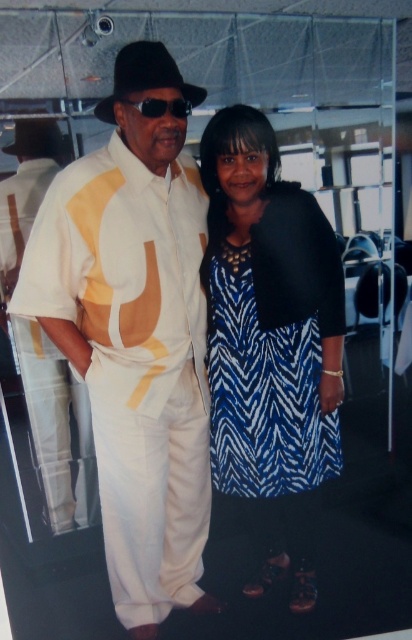
Question: Is blue zebra-patterned dress at center closer to camera compared to sunglasses at center?

Choices:
 (A) no
 (B) yes

Answer: (A)

Question: In this image, where is blue zebra-pattern dress at center located relative to sunglasses at center?

Choices:
 (A) right
 (B) left

Answer: (A)

Question: Which of the following is the farthest from the observer?

Choices:
 (A) blue zebra-pattern dress at center
 (B) white matte suit at left
 (C) sunglasses at center
 (D) blue zebra-patterned dress at center

Answer: (D)

Question: Is white matte suit at left smaller than blue zebra-pattern dress at center?

Choices:
 (A) yes
 (B) no

Answer: (B)

Question: Which object is the farthest from the blue zebra-patterned dress at center?

Choices:
 (A) sunglasses at center
 (B) white matte suit at left

Answer: (A)

Question: Among these points, which one is nearest to the camera?

Choices:
 (A) (316, 332)
 (B) (180, 102)
 (C) (273, 372)
 (D) (60, 173)

Answer: (B)